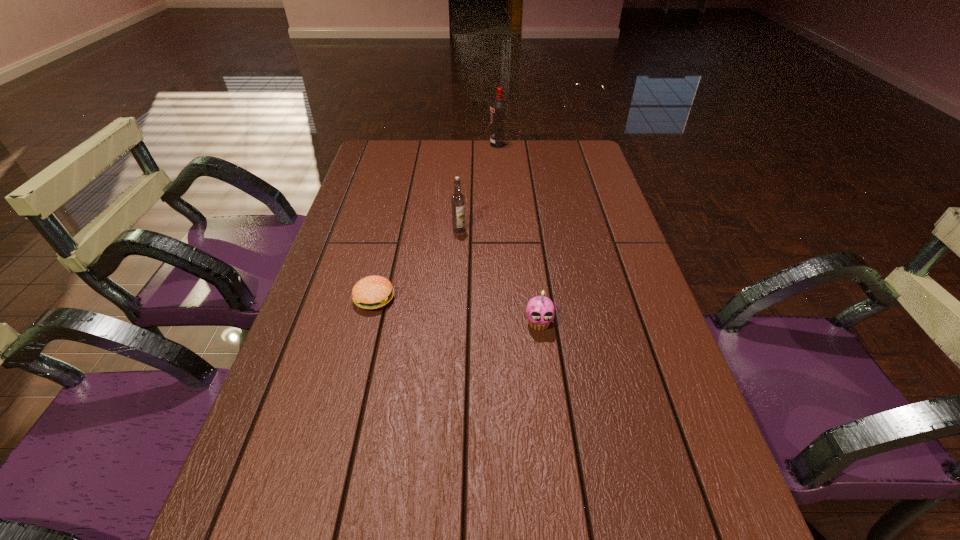
Where is `the taller vodka`? The image size is (960, 540). the taller vodka is located at coordinates (498, 109).

Find the location of a particular element. the right vodka is located at coordinates (498, 109).

Locate an element on the screen. The width and height of the screenshot is (960, 540). the nearer vodka is located at coordinates (457, 199).

Find the location of `the third shortest object`. the third shortest object is located at coordinates (457, 199).

Locate an element on the screen. the rightmost object is located at coordinates (540, 311).

The image size is (960, 540). I want to click on cupcake, so click(540, 311).

The height and width of the screenshot is (540, 960). Identify the location of the shortest object. [x=372, y=292].

I want to click on the leftmost object, so click(372, 292).

Locate an element on the screen. free space located on the front label of the taller vodka is located at coordinates (420, 145).

I want to click on vacant region located on the front label of the taller vodka, so click(x=425, y=145).